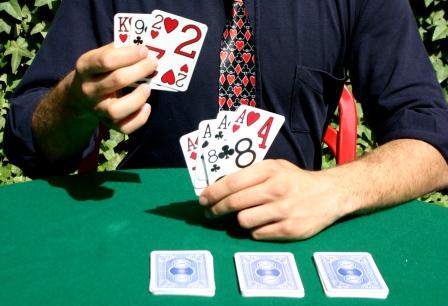
Image resolution: width=448 pixels, height=306 pixels. In order to click on table in this screenshot , I will do `click(361, 249)`.